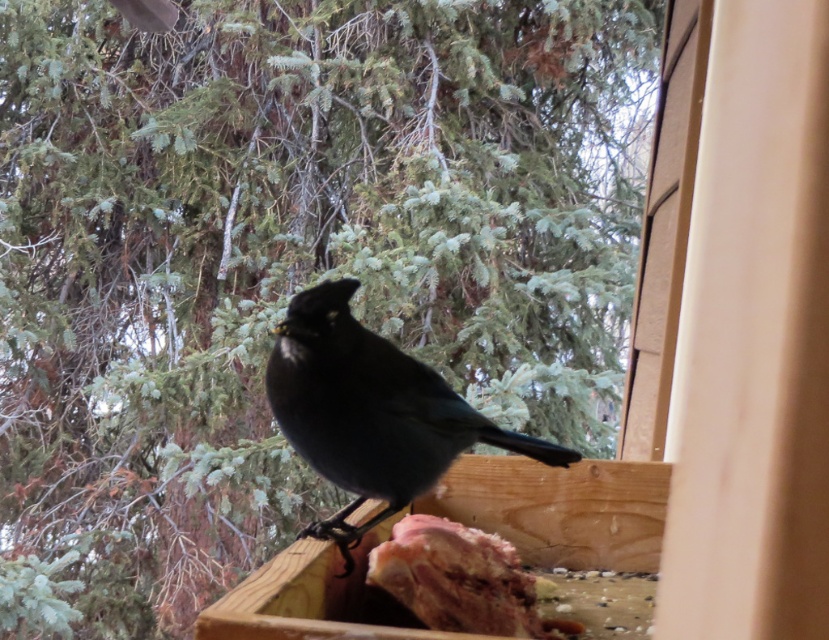
You are a small squirrel trying to get the raw meat at center from the shiny black bird at center. Since the bird is bigger than the meat, can you tell me if the bird is blocking your path to the meat?

The shiny black bird at center is larger in size than the raw meat at center, so it is likely blocking your path to the meat.

You are a birdwatcher observing the black bird on the feeder. You notice two points marked in the image. The first point is at coordinates point (308,330) and the second at point (497,541). Which point is closer to the bird?

Point (308,330) is in front of point (497,541), so it is closer to the bird.

What object is located at the coordinates point (371, 412) in the image?

The point (371, 412) corresponds to the shiny black bird at center.